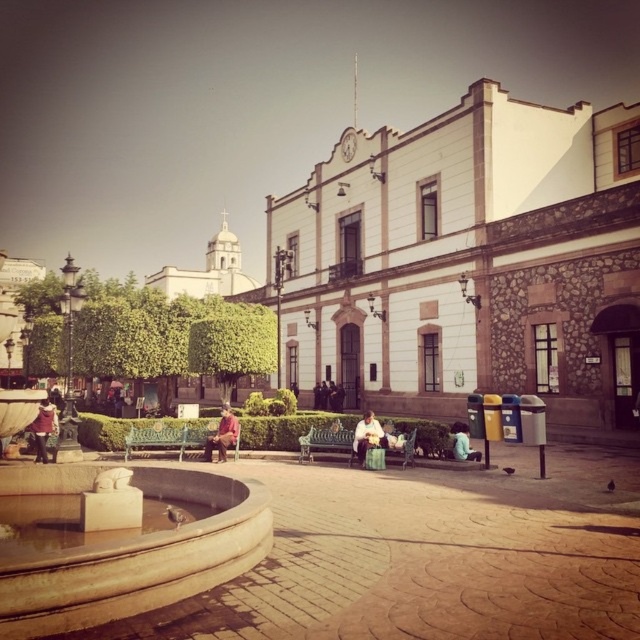
You are a tourist visiting the square and want to place your light brown fabric bag at center on the ground. However, there is a polished wood bench at center in the way. Can you move the bag to the spot where the bench is currently located?

The polished wood bench at center is in front of the light brown fabric bag at center, so the bag is behind the bench. To move the bag to the bench location, you would need to move the bench first.

You are standing in the public square and want to place your light brown fabric bag at center on a surface. Can you put it on the beige stone fountain at lower left?

The beige stone fountain at lower left is below the light brown fabric bag at center, so the bag is not on the fountain. You would need to move the bag to the fountain to place it there.

You are standing at the entrance of the historical building and want to sit down. There is a polished wood bench at center located at point (326, 442). Can you walk directly to it without crossing the hedge?

Yes, you can walk directly to the polished wood bench at center located at point (326, 442) without crossing the hedge because the bench is positioned in the paved area in front of the building, which is separated from the building by the hedge but accessible through the entrance area.